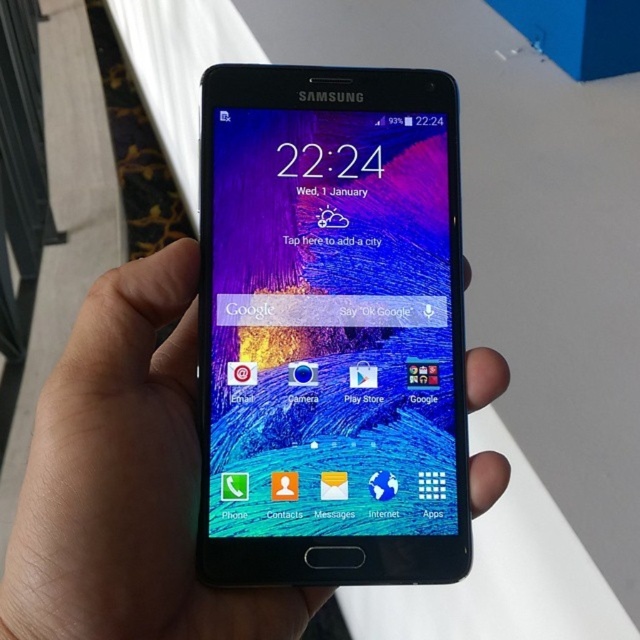
Question: Is matte glass phone at center positioned before black matte phone at center?

Choices:
 (A) yes
 (B) no

Answer: (B)

Question: Which point appears farthest from the camera in this image?

Choices:
 (A) (164, 515)
 (B) (429, 200)

Answer: (B)

Question: Which point is closer to the camera taking this photo?

Choices:
 (A) (60, 513)
 (B) (342, 124)

Answer: (A)

Question: Does matte glass phone at center have a lesser width compared to black matte phone at center?

Choices:
 (A) yes
 (B) no

Answer: (A)

Question: Does matte glass phone at center come in front of black matte phone at center?

Choices:
 (A) yes
 (B) no

Answer: (B)